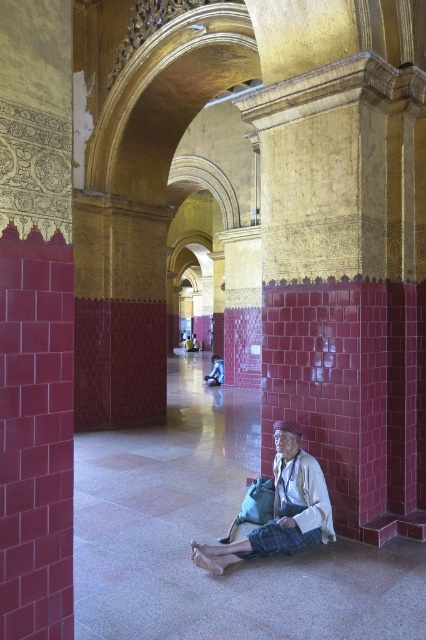
Can you confirm if white fabric cloth at center is positioned below blue fabric bag at center?

Yes.

Is white fabric cloth at center smaller than blue fabric bag at center?

Incorrect, white fabric cloth at center is not smaller in size than blue fabric bag at center.

Is point (291, 492) more distant than point (221, 369)?

That is False.

This screenshot has width=426, height=640. Find the location of `white fabric cloth at center`. white fabric cloth at center is located at coordinates (281, 508).